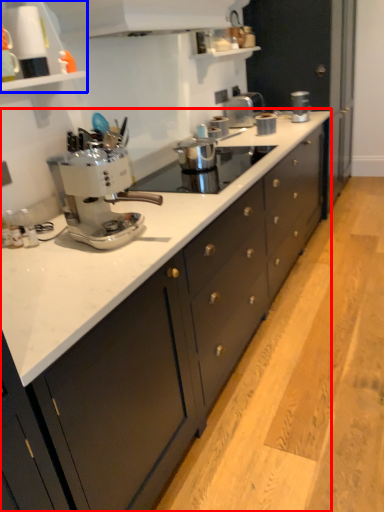
Question: Which object is further to the camera taking this photo, cabinetry (highlighted by a red box) or shelf (highlighted by a blue box)?

Choices:
 (A) cabinetry
 (B) shelf

Answer: (B)